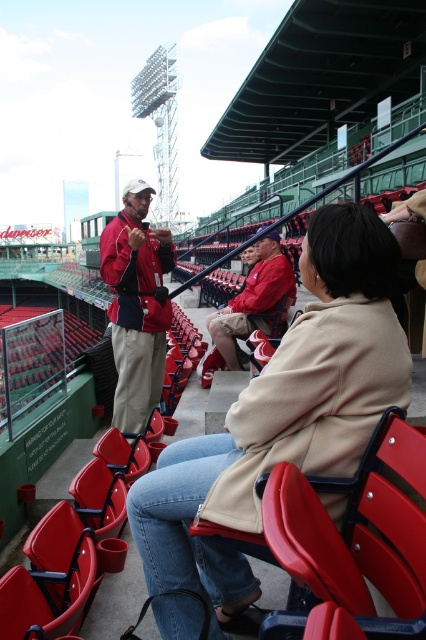
You are a photographer standing at the edge of the baseball stadium field. You want to take a photo that includes both the matte plastic chair at lower center and the matte red jacket at center. Which object should you adjust your camera angle to focus on first to ensure both are in frame?

The matte plastic chair at lower center is closer to the viewer than the matte red jacket at center, so you should focus on the matte plastic chair at lower center first to ensure both are in frame.

You are a stadium cleaner assigned to move the matte plastic chair at lower center and the matte red jacket at center to the storage room. Which object will require more space when stored?

The matte red jacket at center requires more storage space because it occupies more space than the matte plastic chair at lower center according to the description.